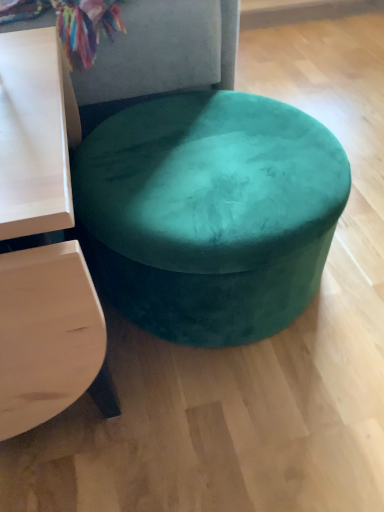
The image size is (384, 512). Find the location of `vacant area that lies between matte white table at left and teal velvet ottoman at center`. vacant area that lies between matte white table at left and teal velvet ottoman at center is located at coordinates (226, 373).